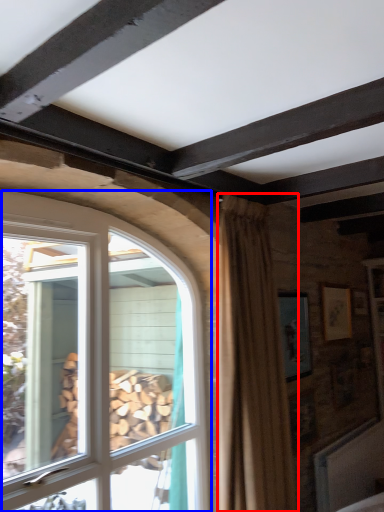
Question: Which object appears closest to the camera in this image, curtain (highlighted by a red box) or window (highlighted by a blue box)?

Choices:
 (A) curtain
 (B) window

Answer: (B)